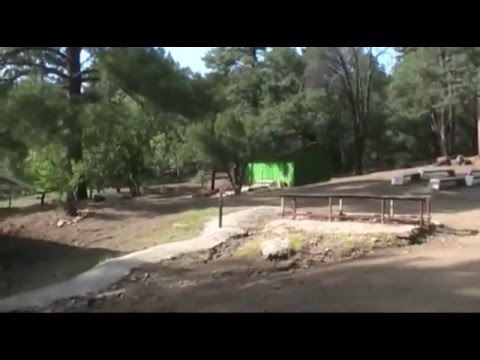
This screenshot has width=480, height=360. In order to click on benches in this screenshot , I will do `click(450, 179)`, `click(434, 168)`, `click(401, 177)`, `click(476, 176)`.